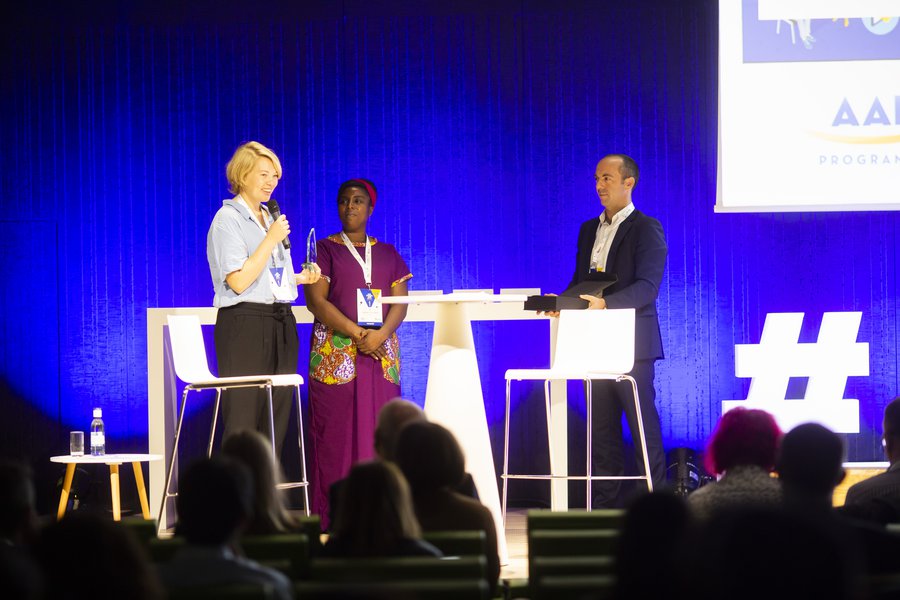
At what (x,y) coordinates should I click in order to perform the action: click on chair. Please return your answer as a coordinate pair (x, y). Looking at the image, I should click on (248, 382), (578, 364).